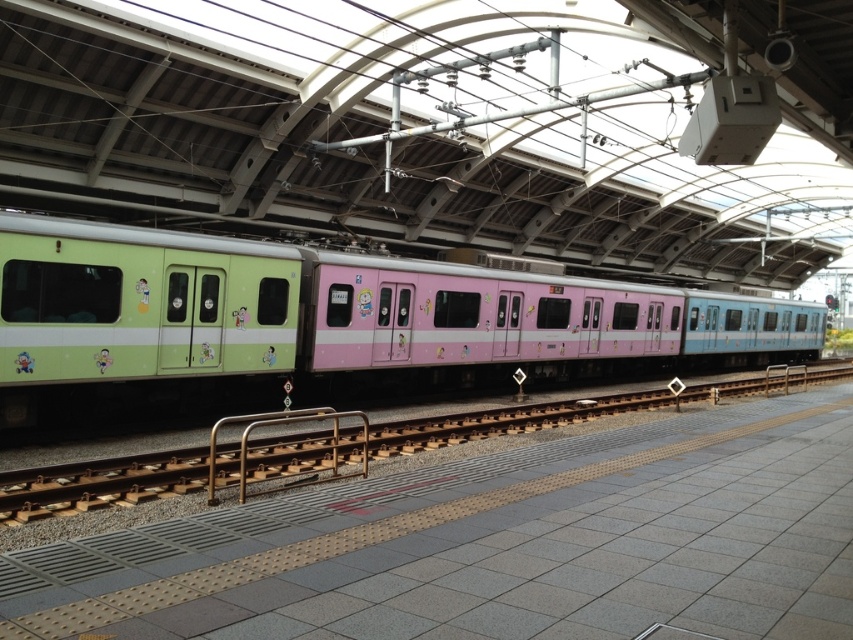
Question: Does pastel matte train at center appear under green matte rail at left?

Choices:
 (A) yes
 (B) no

Answer: (B)

Question: Is the position of pastel matte train at center more distant than that of green matte rail at left?

Choices:
 (A) yes
 (B) no

Answer: (A)

Question: Which point is farther to the camera?

Choices:
 (A) green matte rail at left
 (B) brown metallic rail at center
 (C) pastel matte train at center

Answer: (C)

Question: Which object appears closest to the camera in this image?

Choices:
 (A) pastel matte train at center
 (B) brown metallic rail at center

Answer: (B)

Question: Considering the relative positions of pastel matte train at center and green matte rail at left in the image provided, where is pastel matte train at center located with respect to green matte rail at left?

Choices:
 (A) above
 (B) below

Answer: (A)

Question: Which of these objects is positioned closest to the green matte rail at left?

Choices:
 (A) brown metallic rail at center
 (B) pastel matte train at center

Answer: (B)